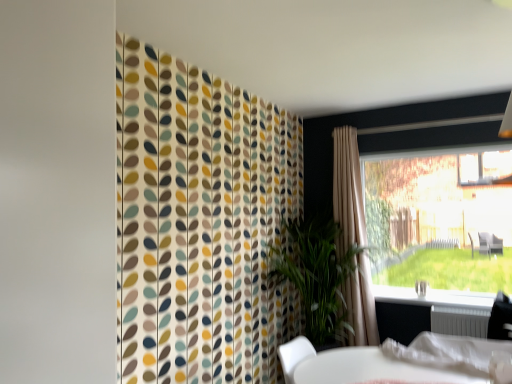
Question: Could beige fabric curtain at right be considered to be inside transparent glass window at right?

Choices:
 (A) no
 (B) yes

Answer: (A)

Question: Does transparent glass window at right have a larger size compared to beige fabric curtain at right?

Choices:
 (A) yes
 (B) no

Answer: (B)

Question: Does transparent glass window at right have a smaller size compared to beige fabric curtain at right?

Choices:
 (A) no
 (B) yes

Answer: (B)

Question: Does transparent glass window at right appear on the left side of beige fabric curtain at right?

Choices:
 (A) yes
 (B) no

Answer: (B)

Question: Considering the relative sizes of transparent glass window at right and beige fabric curtain at right in the image provided, is transparent glass window at right shorter than beige fabric curtain at right?

Choices:
 (A) no
 (B) yes

Answer: (B)

Question: From the image's perspective, is transparent glass window at right on beige fabric curtain at right?

Choices:
 (A) no
 (B) yes

Answer: (B)

Question: From the image's perspective, would you say white metallic radiator at lower right is positioned over white plastic window sill at lower right?

Choices:
 (A) yes
 (B) no

Answer: (B)

Question: Are white metallic radiator at lower right and white plastic window sill at lower right far apart?

Choices:
 (A) no
 (B) yes

Answer: (A)

Question: Is white metallic radiator at lower right looking in the opposite direction of white plastic window sill at lower right?

Choices:
 (A) yes
 (B) no

Answer: (A)

Question: Is white metallic radiator at lower right taller than white plastic window sill at lower right?

Choices:
 (A) yes
 (B) no

Answer: (A)

Question: Considering the relative positions of white metallic radiator at lower right and white plastic window sill at lower right in the image provided, is white metallic radiator at lower right behind white plastic window sill at lower right?

Choices:
 (A) yes
 (B) no

Answer: (B)

Question: Could you tell me if white metallic radiator at lower right is turned towards white plastic window sill at lower right?

Choices:
 (A) no
 (B) yes

Answer: (A)

Question: Is white metallic radiator at lower right not within white plastic bag at lower right?

Choices:
 (A) no
 (B) yes

Answer: (B)